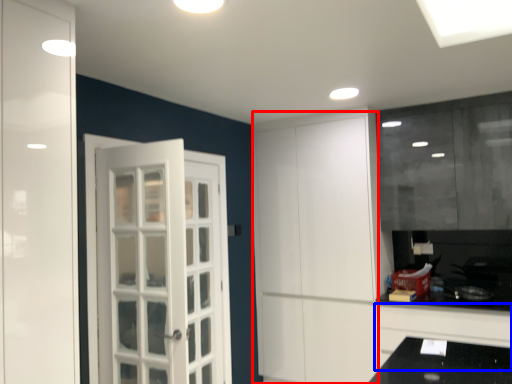
Question: Which object is further to the camera taking this photo, door (highlighted by a red box) or cabinetry (highlighted by a blue box)?

Choices:
 (A) door
 (B) cabinetry

Answer: (A)